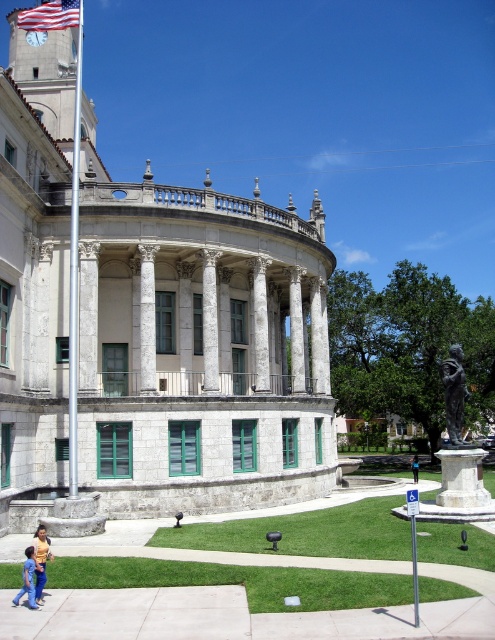
Question: Based on their relative distances, which object is nearer to the american flag at upper left?

Choices:
 (A) white marble column at center
 (B) jeans at lower left

Answer: (A)

Question: Which point appears closest to the camera in this image?

Choices:
 (A) (43, 579)
 (B) (79, 49)
 (C) (414, 464)

Answer: (A)

Question: From the image, what is the correct spatial relationship of bronze statue at center in relation to jeans at lower left?

Choices:
 (A) below
 (B) above

Answer: (B)

Question: Is the position of polished metal flag pole at left less distant than that of american flag at upper left?

Choices:
 (A) no
 (B) yes

Answer: (B)

Question: Can you confirm if blue jeans at lower left is bigger than blue fabric shirt at center?

Choices:
 (A) no
 (B) yes

Answer: (A)

Question: Which object is positioned farthest from the american flag at upper left?

Choices:
 (A) jeans at lower left
 (B) blue jeans at lower left
 (C) white marble column at center

Answer: (A)